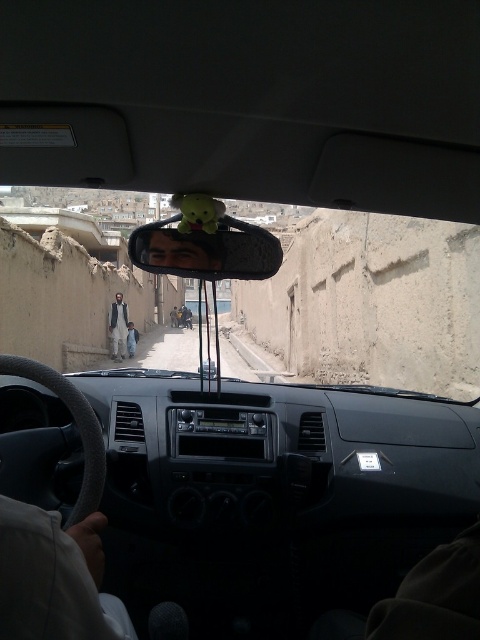
Question: Can you confirm if light brown textured jacket at center is positioned to the left of light brown fabric jacket at left?

Choices:
 (A) no
 (B) yes

Answer: (B)

Question: Estimate the real-world distances between objects in this image. Which object is farther from the matte plastic mirror at center?

Choices:
 (A) light brown textured jacket at center
 (B) light brown fabric jacket at left

Answer: (B)

Question: Which of the following is the farthest from the observer?

Choices:
 (A) light brown textured jacket at center
 (B) matte plastic mirror at center
 (C) light brown fabric jacket at left

Answer: (C)

Question: Among these points, which one is nearest to the camera?

Choices:
 (A) (147, 259)
 (B) (129, 355)

Answer: (A)

Question: Does matte plastic mirror at center have a lesser width compared to light brown fabric jacket at left?

Choices:
 (A) no
 (B) yes

Answer: (A)

Question: Is matte plastic mirror at center behind light brown textured jacket at center?

Choices:
 (A) yes
 (B) no

Answer: (B)